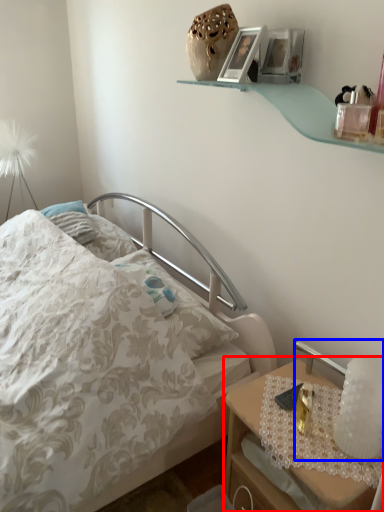
Question: Which object appears farthest to the camera in this image, nightstand (highlighted by a red box) or bedside lamp (highlighted by a blue box)?

Choices:
 (A) nightstand
 (B) bedside lamp

Answer: (B)